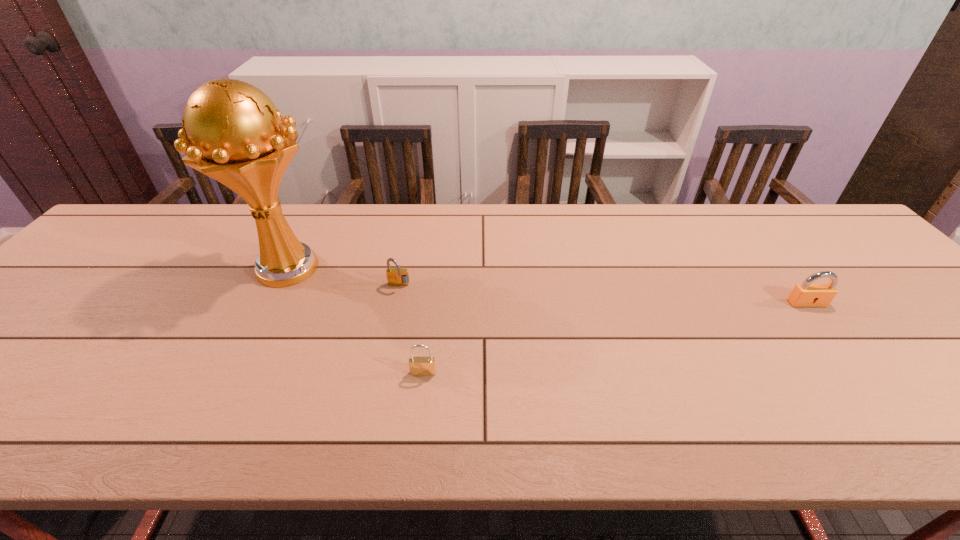
Locate an element on the screen. trophy_cup is located at coordinates (232, 132).

Identify the location of the leftmost object. click(232, 132).

Locate an element on the screen. the rightmost padlock is located at coordinates (807, 294).

Image resolution: width=960 pixels, height=540 pixels. I want to click on the second nearest padlock, so (x=807, y=294).

The image size is (960, 540). I want to click on the third object from right to left, so point(398,276).

You are a GUI agent. You are given a task and a screenshot of the screen. Output one action in this format:
    pyautogui.click(x=<x>, y=<y>)
    Task: Click on the leftmost padlock
    
    Given the screenshot: What is the action you would take?
    pyautogui.click(x=398, y=276)

Locate an element on the screen. This screenshot has height=540, width=960. the second object from right to left is located at coordinates (419, 366).

Find the location of a particular element. Image resolution: width=960 pixels, height=540 pixels. the second padlock from left to right is located at coordinates (419, 366).

This screenshot has height=540, width=960. I want to click on free space located at the front of the trophy_cup where the globe is prominent, so click(x=197, y=446).

Locate an element on the screen. The image size is (960, 540). vacant region located 0.060m to unlock the rightmost padlock from the front is located at coordinates [x=825, y=326].